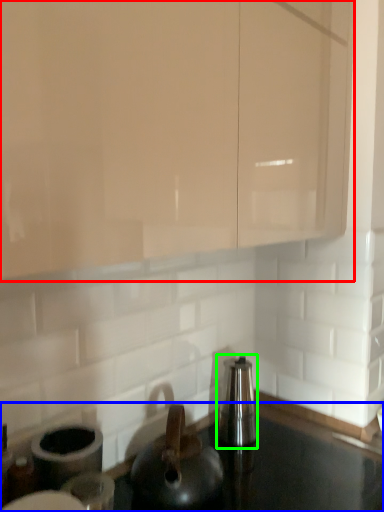
Question: Which object is the farthest from cabinetry (highlighted by a red box)? Choose among these: countertop (highlighted by a blue box) or appliance (highlighted by a green box).

Choices:
 (A) countertop
 (B) appliance

Answer: (A)